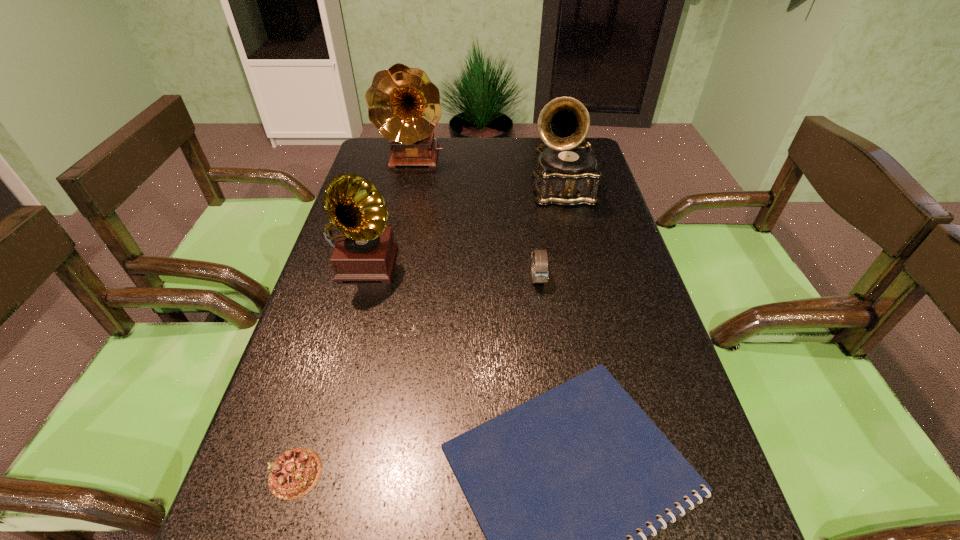
What are the coordinates of `the rightmost phonograph record` in the screenshot? It's located at [x=567, y=174].

Locate an element on the screen. the shortest phonograph record is located at coordinates (365, 250).

Locate an element on the screen. the nearest phonograph record is located at coordinates (365, 250).

This screenshot has width=960, height=540. I want to click on watch, so click(x=539, y=257).

This screenshot has height=540, width=960. In order to click on chocolate cake in this screenshot , I will do `click(295, 473)`.

I want to click on vacant space located 0.180m on the horn of the rightmost phonograph record, so click(x=577, y=257).

This screenshot has width=960, height=540. I want to click on vacant space located 0.120m from the horn of the shortest phonograph record, so 345,338.

Locate an element on the screen. This screenshot has width=960, height=540. vacant space located on the face of the watch is located at coordinates coord(554,397).

What are the coordinates of `vacant space located 0.130m on the back of the chocolate cake` in the screenshot? It's located at (323, 383).

Locate an element on the screen. The image size is (960, 540). chocolate cake present at the left edge is located at coordinates (295, 473).